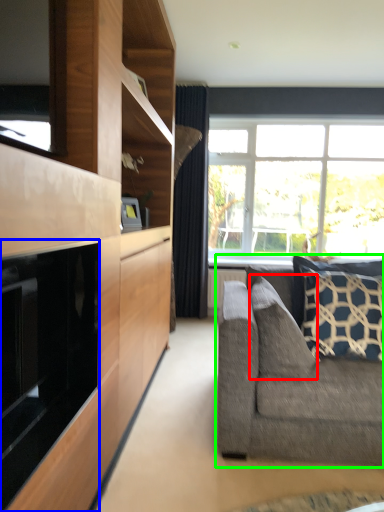
Question: Based on their relative distances, which object is farther from pillow (highlighted by a red box)? Choose from fireplace (highlighted by a blue box) and studio couch (highlighted by a green box).

Choices:
 (A) fireplace
 (B) studio couch

Answer: (A)